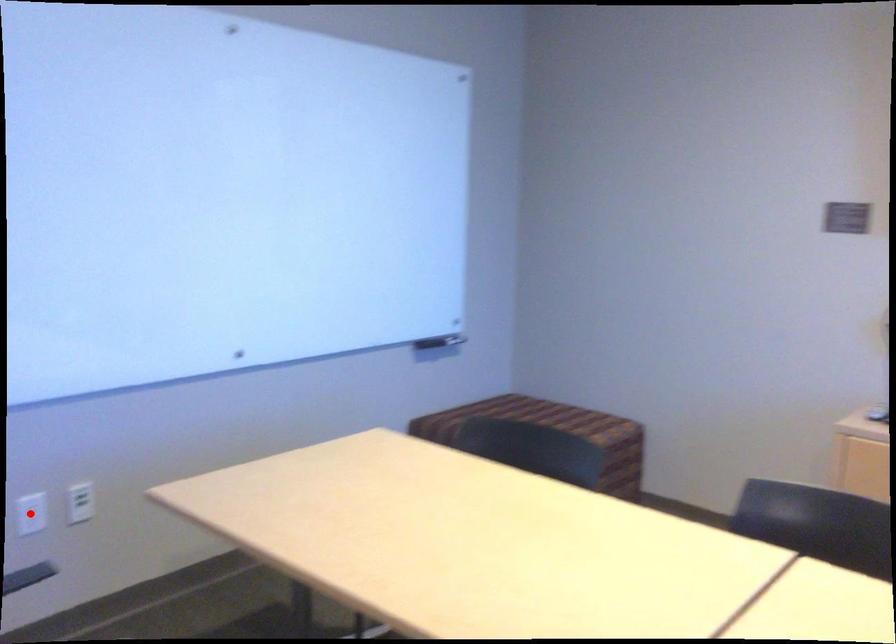
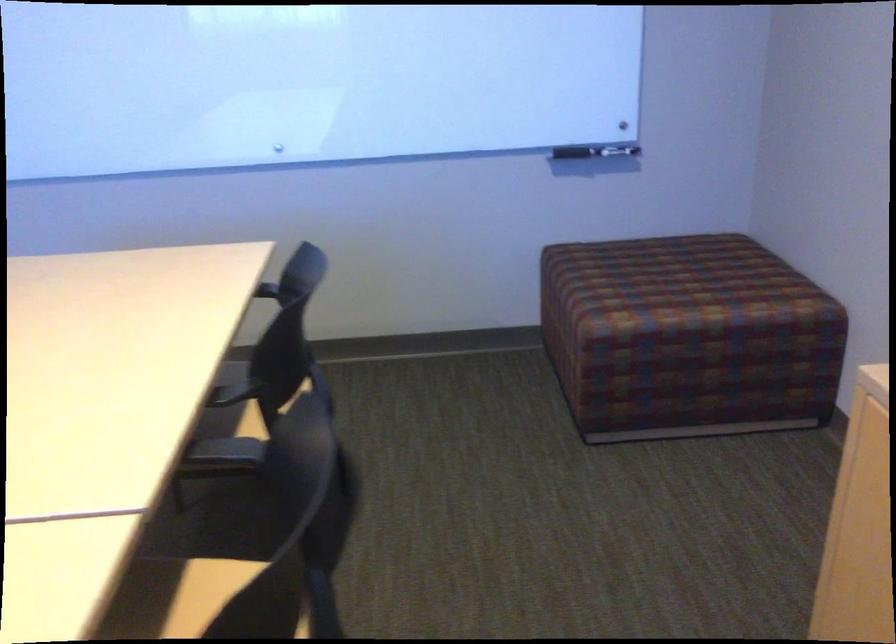
Question: I am providing you with two images of the same scene from different viewpoints. A red point is marked on the first image. Can you still see the location of the red point in image 2?

Choices:
 (A) Yes
 (B) No

Answer: (B)